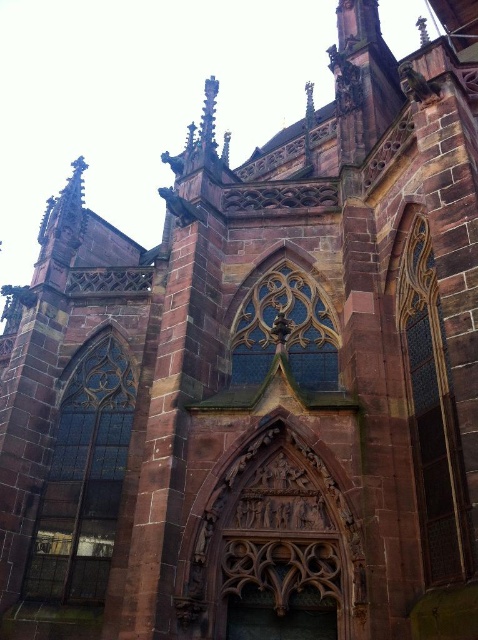
Question: Which point appears closest to the camera in this image?

Choices:
 (A) (324, 378)
 (B) (454, 572)

Answer: (B)

Question: Which point appears farthest from the camera in this image?

Choices:
 (A) (268, 284)
 (B) (65, 422)
 (C) (467, 554)

Answer: (B)

Question: Does stained glass window at left appear on the left side of dark stained glass window at right?

Choices:
 (A) yes
 (B) no

Answer: (A)

Question: Does stained glass window at left lie behind translucent stained glass at center?

Choices:
 (A) yes
 (B) no

Answer: (A)

Question: Is stained glass window at left smaller than dark stained glass window at right?

Choices:
 (A) yes
 (B) no

Answer: (B)

Question: Which of the following is the closest to the observer?

Choices:
 (A) stained glass window at left
 (B) dark stained glass window at right

Answer: (B)